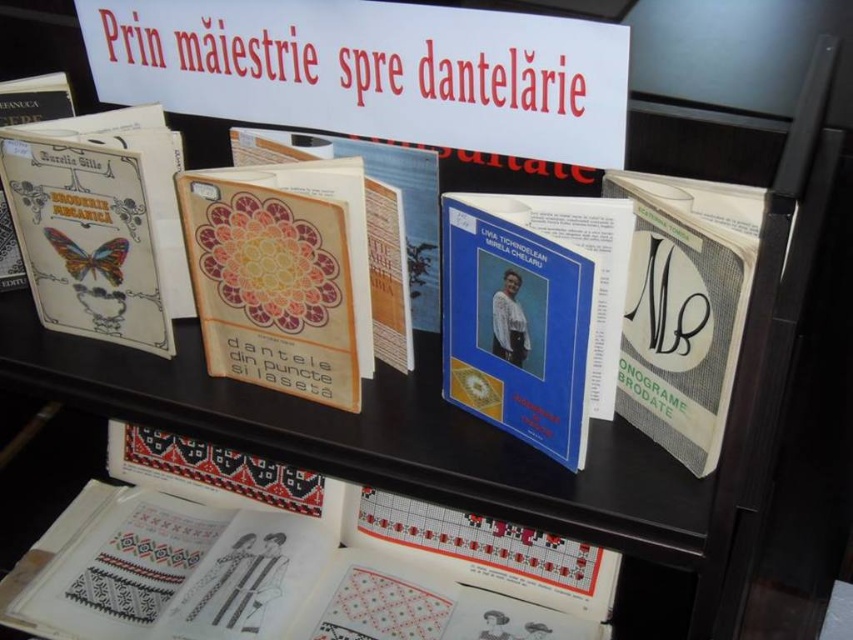
You are a visitor at the book display and want to know which object is higher. You see the matte paper butterfly at left and the matte orange floral book at center. Which one is positioned higher?

The matte paper butterfly at left is positioned higher than the matte orange floral book at center.

What is the exact coordinate of the white paper with black and red patterns at lower center?

The white paper with black and red patterns at lower center is located at coordinate point (247, 580).

You are a book collector who wants to place a new book between the matte paper butterfly at left and the matte orange floral book at center. The new book is 5 inches thick. Will it fit in the space between them?

The space between the matte paper butterfly at left and the matte orange floral book at center is 4.91 inches. Since the new book is 5 inches thick, it will not fit in the available space.